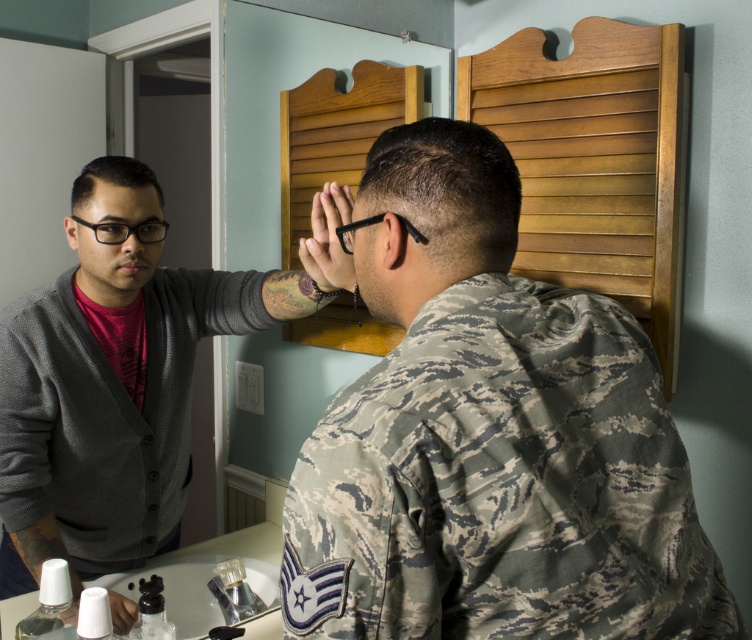
Based on the scene description, which object is larger in size between the gray matte cardigan at left and the dark brown matte hair at center?

The gray matte cardigan at left is bigger than the dark brown matte hair at center.

You are a photographer setting up a shoot in this bathroom. You need to position a light source so that it illuminates both the gray matte cardigan at left and the dark brown matte hair at center without causing harsh shadows. Which object should be closer to the light source to achieve even lighting?

The gray matte cardigan at left is closer to the viewer than the dark brown matte hair at center, so positioning the light source closer to the cardigan would help balance the lighting between both objects.

From the picture: You are a tailor measuring a mannequin dressed in the camouflage fabric uniform at center and dark brown matte hair at center. Which object requires a larger measurement tape size?

The camouflage fabric uniform at center requires a larger measurement tape size because it has a larger size compared to the dark brown matte hair at center.